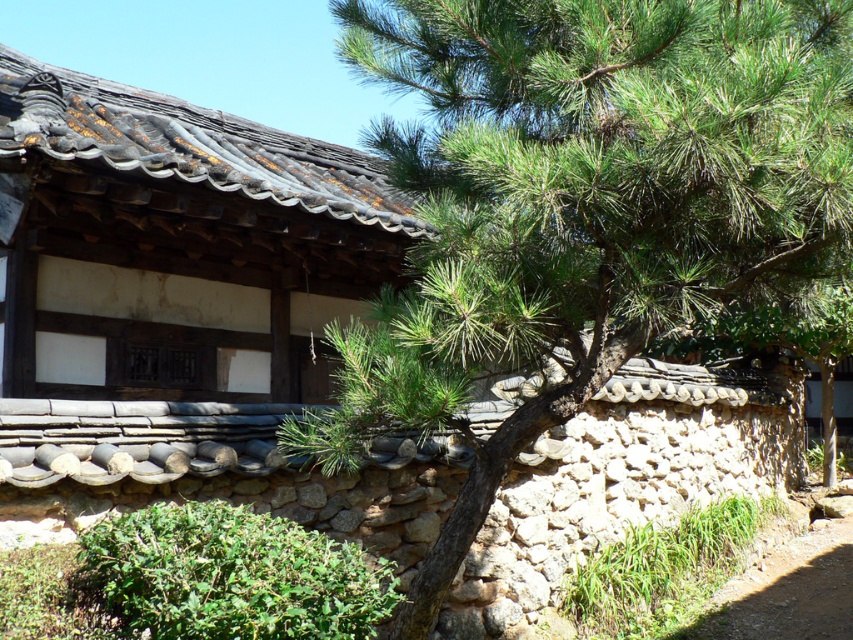
You are standing in front of a traditional Korean house. There is a point marked at coordinates (579, 209). What object does this point correspond to?

The point at coordinates (579, 209) corresponds to the green needle leaves at center.